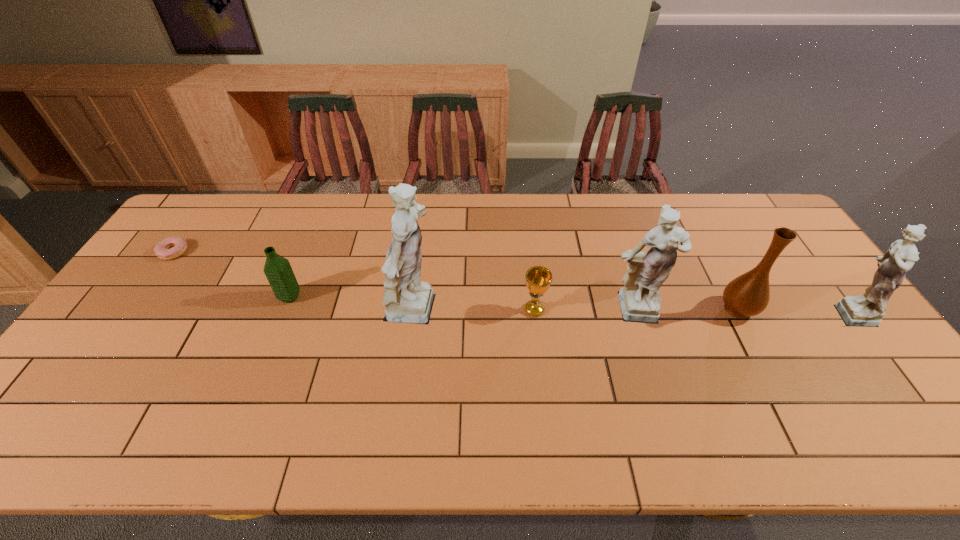
Identify the location of vacant space located on the back of the fourth object from left to right. The width and height of the screenshot is (960, 540). (530, 271).

This screenshot has width=960, height=540. I want to click on object that is at the left edge, so pyautogui.click(x=178, y=246).

Locate an element on the screen. This screenshot has width=960, height=540. object situated at the right edge is located at coordinates (867, 310).

Find the location of a particular element. This screenshot has height=540, width=960. vacant region at the far edge of the desktop is located at coordinates (383, 208).

At what (x,y) coordinates should I click in order to perform the action: click on vacant space at the near edge of the desktop. Please return your answer as a coordinate pair (x, y). The height and width of the screenshot is (540, 960). Looking at the image, I should click on (471, 396).

Identify the location of free space at the right edge of the desktop. (874, 375).

I want to click on vacant space at the far left corner of the desktop, so click(x=205, y=226).

I want to click on vacant space at the near left corner, so [100, 401].

Locate an element on the screen. The image size is (960, 540). free location at the far right corner of the desktop is located at coordinates (746, 237).

Image resolution: width=960 pixels, height=540 pixels. In order to click on unoccupied area between the shortest object and the sixth object from right to left in this screenshot , I will do `click(231, 274)`.